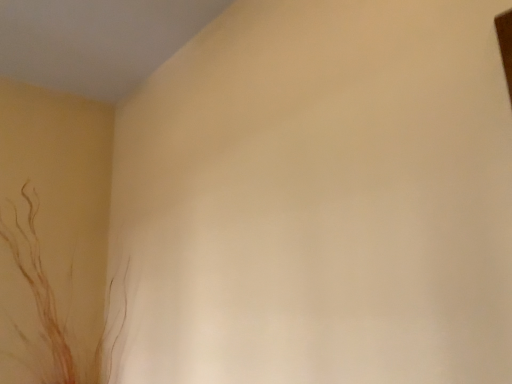
This screenshot has width=512, height=384. I want to click on brown translucent plant at lower left, so click(41, 288).

Describe the element at coordinates (41, 288) in the screenshot. I see `brown translucent plant at lower left` at that location.

Locate an element on the screen. The height and width of the screenshot is (384, 512). brown translucent plant at lower left is located at coordinates (41, 288).